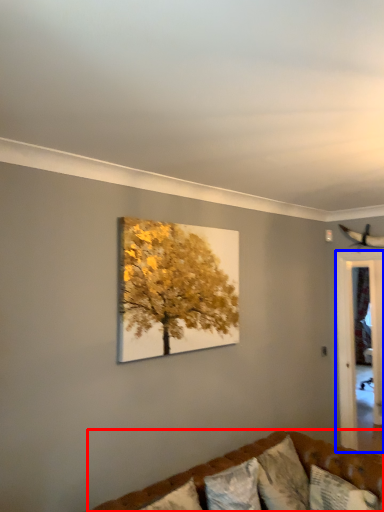
Question: Which object appears closest to the camera in this image, studio couch (highlighted by a red box) or glass door (highlighted by a blue box)?

Choices:
 (A) studio couch
 (B) glass door

Answer: (A)